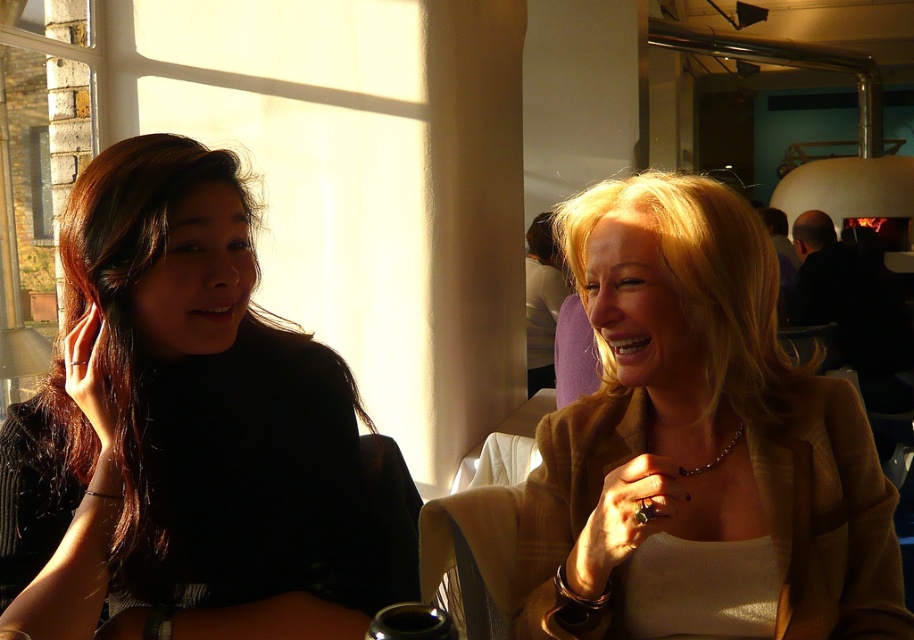
Can you confirm if black matte shirt at left is positioned to the left of matte gold blazer at center?

Yes, black matte shirt at left is to the left of matte gold blazer at center.

Is black matte shirt at left positioned behind matte gold blazer at center?

No, black matte shirt at left is in front of matte gold blazer at center.

Which is in front, point (169, 248) or point (683, 195)?

Point (169, 248) is more forward.

Locate an element on the screen. This screenshot has height=640, width=914. black matte shirt at left is located at coordinates [x=181, y=429].